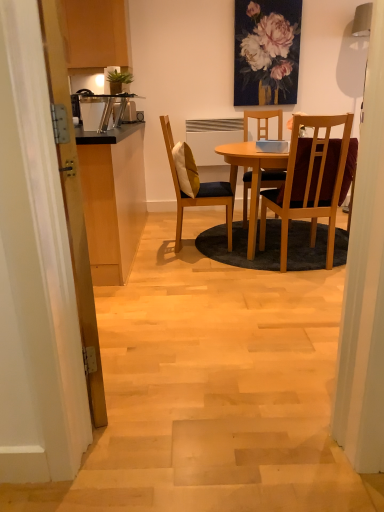
Question: From a real-world perspective, is wooden table at center physically below yellow fabric pillow at center?

Choices:
 (A) yes
 (B) no

Answer: (A)

Question: Is wooden table at center further to the viewer compared to yellow fabric pillow at center?

Choices:
 (A) yes
 (B) no

Answer: (B)

Question: Is wooden table at center oriented away from yellow fabric pillow at center?

Choices:
 (A) yes
 (B) no

Answer: (A)

Question: Is wooden table at center oriented towards yellow fabric pillow at center?

Choices:
 (A) no
 (B) yes

Answer: (A)

Question: Considering the relative sizes of wooden table at center and yellow fabric pillow at center in the image provided, is wooden table at center wider than yellow fabric pillow at center?

Choices:
 (A) no
 (B) yes

Answer: (B)

Question: From the image's perspective, is wooden door at left above or below yellow fabric pillow at center?

Choices:
 (A) below
 (B) above

Answer: (A)

Question: Is wooden door at left wider or thinner than yellow fabric pillow at center?

Choices:
 (A) thin
 (B) wide

Answer: (A)

Question: Relative to yellow fabric pillow at center, is wooden door at left in front or behind?

Choices:
 (A) behind
 (B) front

Answer: (B)

Question: In terms of height, does wooden door at left look taller or shorter compared to yellow fabric pillow at center?

Choices:
 (A) tall
 (B) short

Answer: (A)

Question: Which is correct: matte floral painting at upper center is inside yellow fabric pillow at center, or outside of it?

Choices:
 (A) outside
 (B) inside

Answer: (A)

Question: From the image's perspective, is matte floral painting at upper center above or below yellow fabric pillow at center?

Choices:
 (A) above
 (B) below

Answer: (A)

Question: Considering the positions of matte floral painting at upper center and yellow fabric pillow at center in the image, is matte floral painting at upper center wider or thinner than yellow fabric pillow at center?

Choices:
 (A) thin
 (B) wide

Answer: (A)

Question: In the image, is matte floral painting at upper center on the left side or the right side of yellow fabric pillow at center?

Choices:
 (A) left
 (B) right

Answer: (B)

Question: Is wooden chair with dark cushioning at center, the second chair from the left, wider or thinner than matte floral painting at upper center?

Choices:
 (A) wide
 (B) thin

Answer: (A)

Question: From the image's perspective, is wooden chair with dark cushioning at center, which ranks as the 1th chair in right-to-left order, located above or below matte floral painting at upper center?

Choices:
 (A) below
 (B) above

Answer: (A)